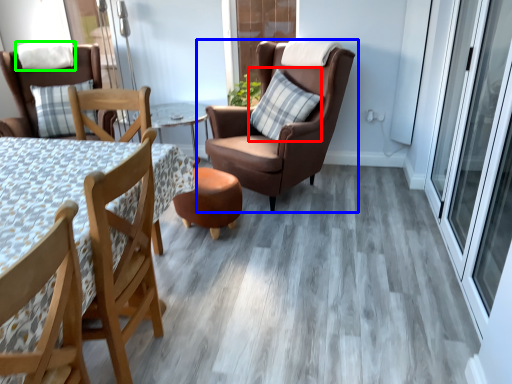
Question: Based on their relative distances, which object is farther from pillow (highlighted by a red box)? Choose from chair (highlighted by a blue box) and pillow (highlighted by a green box).

Choices:
 (A) chair
 (B) pillow

Answer: (B)